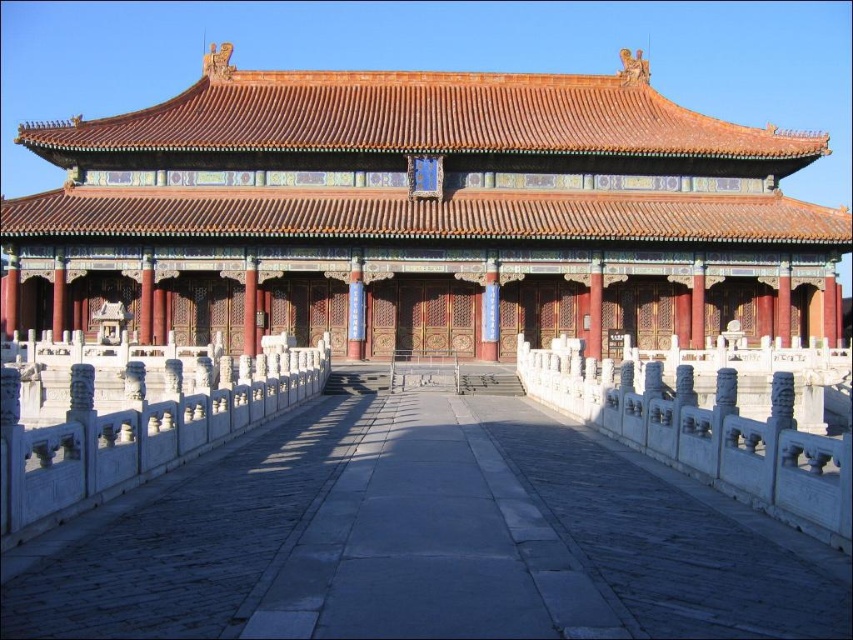
Question: Which object appears closest to the camera in this image?

Choices:
 (A) white marble railing at left
 (B) white marble railing at center
 (C) matte gold roof at center

Answer: (A)

Question: From the image, what is the correct spatial relationship of white marble railing at left in relation to white marble railing at center?

Choices:
 (A) below
 (B) above

Answer: (B)

Question: Which point appears farthest from the camera in this image?

Choices:
 (A) click(x=840, y=500)
 (B) click(x=79, y=440)

Answer: (B)

Question: Does matte gold roof at center appear on the right side of white marble railing at center?

Choices:
 (A) no
 (B) yes

Answer: (A)

Question: Which object is farther from the camera taking this photo?

Choices:
 (A) matte gold roof at center
 (B) white marble railing at left
 (C) white marble railing at center

Answer: (A)

Question: Can you confirm if white marble railing at left is positioned above white marble railing at center?

Choices:
 (A) no
 (B) yes

Answer: (B)